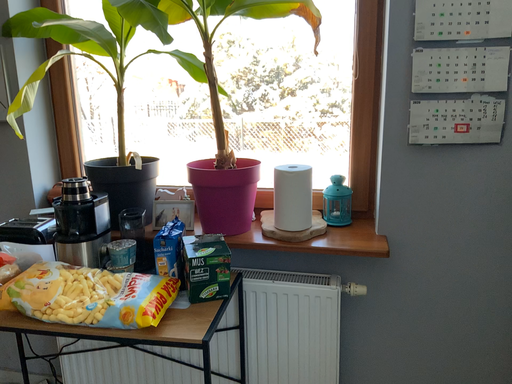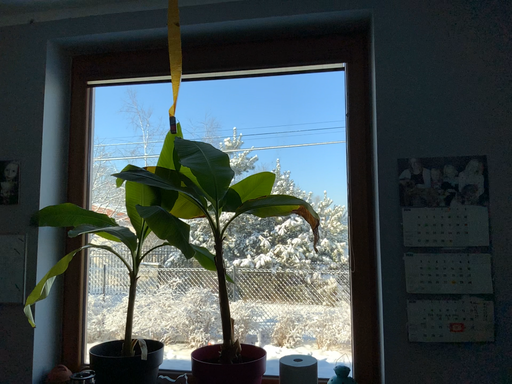
Question: How did the camera likely rotate when shooting the video?

Choices:
 (A) rotated downward
 (B) rotated upward

Answer: (B)